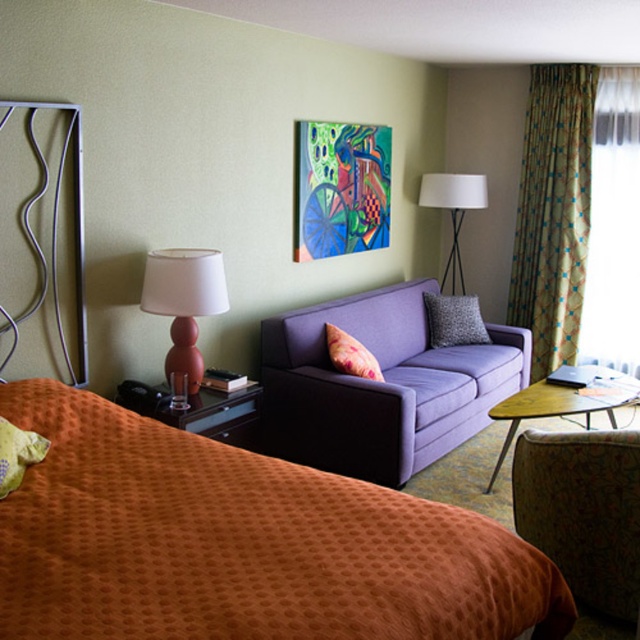
You are standing in the hotel room and want to move from the sofa to the nightstand. The sofa is located at point (10, 563) and the nightstand is at point (451, 208). Which point should you move towards first?

You should move towards point (10, 563) first because it is in front of point (451, 208), meaning it is closer to you.

You are a guest in this hotel room and want to place a rectangular decorative item that is 2 feet wide on either the green patterned curtain at right or the floral fabric pillow at center. Based on the available space, which location would you choose?

The green patterned curtain at right might be wider than floral fabric pillow at center, so placing the 2 feet wide decorative item on the green patterned curtain at right would be more suitable as it likely has enough space.

You are standing in the hotel room and want to reach a specific point marked at coordinates point (400, 506). If your reach extends 6 feet, can you touch that point without moving your feet?

The distance of point (400, 506) from camera is 7.07 feet, so you cannot touch it as it is beyond your 6 feet reach.